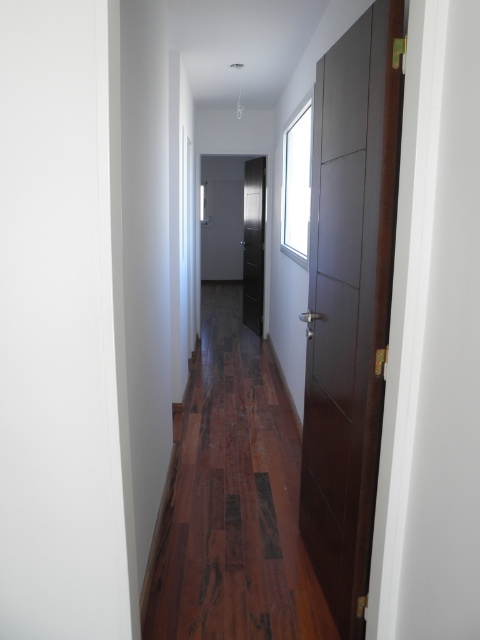
Question: Estimate the real-world distances between objects in this image. Which object is farther from the dark wood door at right?

Choices:
 (A) dark wood door at center
 (B) brown wood flooring at center

Answer: (A)

Question: Which point is farther from the camera taking this photo?

Choices:
 (A) (194, 566)
 (B) (257, 179)
 (C) (328, 314)

Answer: (B)

Question: Can you confirm if brown wood flooring at center is wider than dark wood door at center?

Choices:
 (A) yes
 (B) no

Answer: (A)

Question: Can you confirm if dark wood floor at center is wider than dark wood door at right?

Choices:
 (A) no
 (B) yes

Answer: (A)

Question: Can you confirm if brown wood flooring at center is thinner than dark wood door at center?

Choices:
 (A) no
 (B) yes

Answer: (A)

Question: Which object appears closest to the camera in this image?

Choices:
 (A) dark wood door at right
 (B) dark wood door at center

Answer: (A)